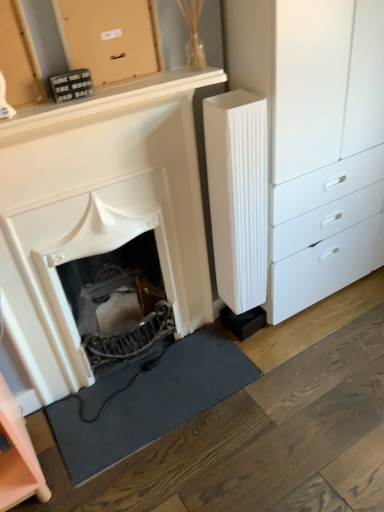
Find the location of a particular element. The height and width of the screenshot is (512, 384). free space between white ribbed radiator at right and black rubber doormat at lower left is located at coordinates (252, 351).